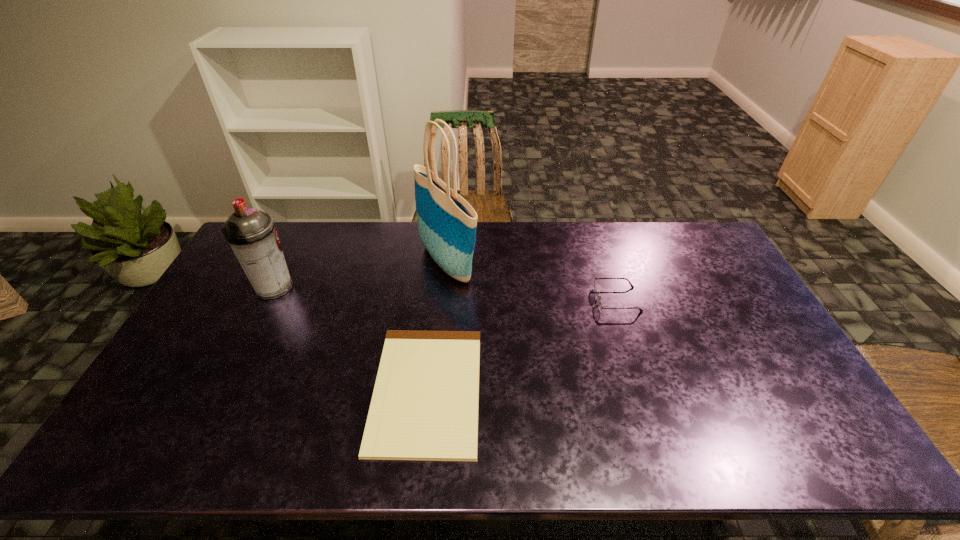
This screenshot has width=960, height=540. Identify the location of tote bag. (447, 223).

At what (x,y) coordinates should I click in order to perform the action: click on aerosol can. Please return your answer as a coordinate pair (x, y). Looking at the image, I should click on (251, 233).

Locate an element on the screen. This screenshot has width=960, height=540. the second tallest object is located at coordinates (251, 233).

Identify the location of the rightmost object. The width and height of the screenshot is (960, 540). (598, 297).

Identify the location of spectacles. (598, 297).

Locate an element on the screen. Image resolution: width=960 pixels, height=540 pixels. clipboard is located at coordinates (424, 407).

Where is `the shortest object`? This screenshot has width=960, height=540. the shortest object is located at coordinates (424, 407).

Find the location of a particular element. Image resolution: width=960 pixels, height=540 pixels. vacant region located on the left of the tote bag is located at coordinates (385, 263).

Identify the location of vacant space located on the back of the aerosol can. This screenshot has height=540, width=960. (292, 251).

Where is `free spot located on the front-facing side of the spectacles`? Image resolution: width=960 pixels, height=540 pixels. free spot located on the front-facing side of the spectacles is located at coordinates (544, 299).